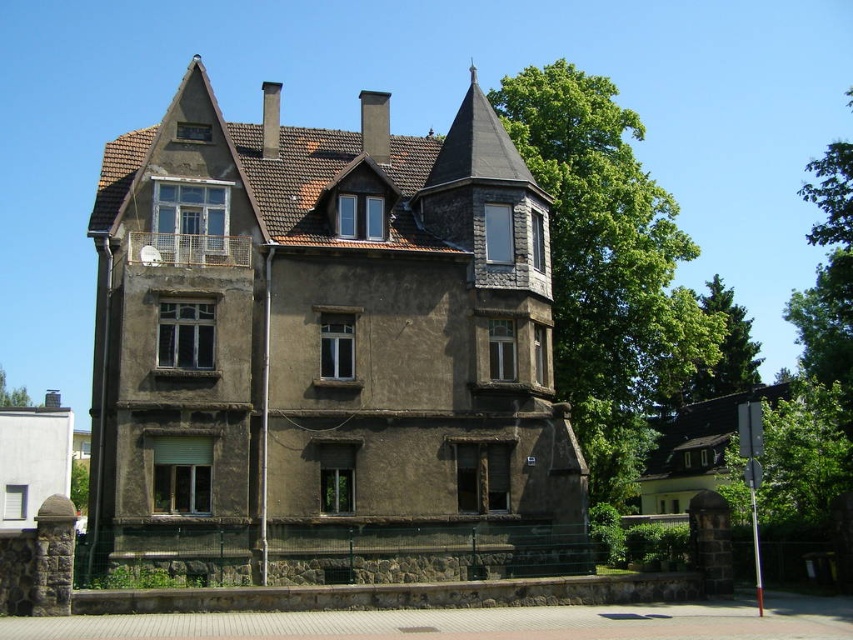
From the picture: Is dark brown stone tower at center further to the viewer compared to green leafy tree at upper center?

That is False.

Who is positioned more to the left, dark brown stone tower at center or green leafy tree at upper center?

green leafy tree at upper center is more to the left.

Which is in front, point (178, 241) or point (4, 396)?

Point (178, 241)

This screenshot has height=640, width=853. What are the coordinates of `dark brown stone tower at center` in the screenshot? It's located at (326, 339).